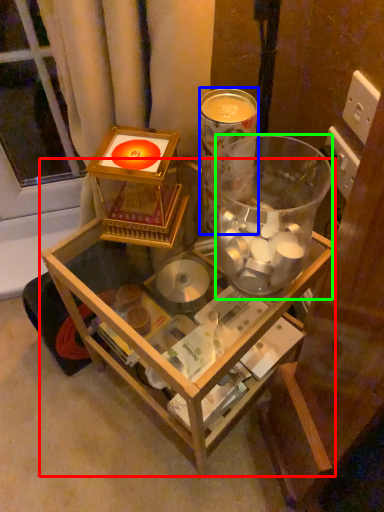
Question: Which object is positioned closest to table (highlighted by a red box)? Select from beverage (highlighted by a blue box) and beverage (highlighted by a green box).

Choices:
 (A) beverage
 (B) beverage

Answer: (B)